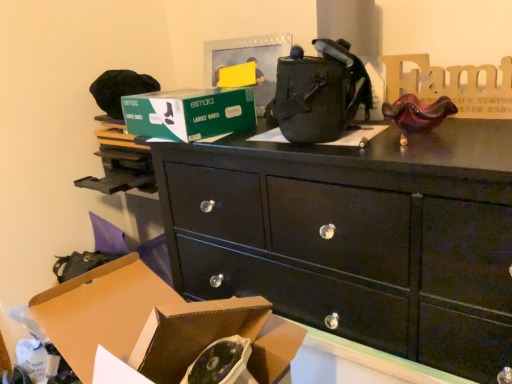
Question: From a real-world perspective, is black glossy chest of drawers at center physically located above or below green cardboard box at upper center, arranged as the 1th box when viewed from the back?

Choices:
 (A) above
 (B) below

Answer: (B)

Question: Looking at their shapes, would you say black glossy chest of drawers at center is wider or thinner than green cardboard box at upper center, arranged as the 1th box when viewed from the back?

Choices:
 (A) thin
 (B) wide

Answer: (B)

Question: Considering the real-world distances, which object is closest to the brown cardboard box at lower left, the first box from the front?

Choices:
 (A) green cardboard box at upper center, which is the 1th box from top to bottom
 (B) black glossy chest of drawers at center

Answer: (B)

Question: Which of these objects is positioned farthest from the brown cardboard box at lower left, the first box in the bottom-to-top sequence?

Choices:
 (A) green cardboard box at upper center, placed as the 2th box when sorted from front to back
 (B) black glossy chest of drawers at center

Answer: (A)